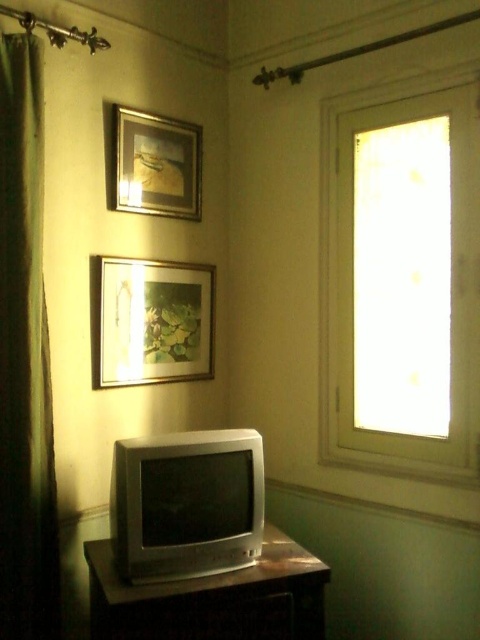
Which is below, transparent glass window at upper right or metallic silver dresser at lower center?

Positioned lower is metallic silver dresser at lower center.

Does transparent glass window at upper right appear on the left side of metallic silver dresser at lower center?

No, transparent glass window at upper right is not to the left of metallic silver dresser at lower center.

Which is in front, point (457, 476) or point (324, 602)?

Point (324, 602) is more forward.

This screenshot has width=480, height=640. In order to click on transparent glass window at upper right in this screenshot , I will do `click(352, 276)`.

Based on the photo, who is shorter, transparent glass window at upper right or green fabric curtain at left?

Standing shorter between the two is transparent glass window at upper right.

Between transparent glass window at upper right and green fabric curtain at left, which one appears on the left side from the viewer's perspective?

green fabric curtain at left

Which is behind, point (470, 96) or point (35, 147)?

Point (470, 96)

Identify the location of transparent glass window at upper right. The width and height of the screenshot is (480, 640). (352, 276).

Looking at this image, does metallic silver dresser at lower center appear on the right side of matte wooden picture frame at center?

Correct, you'll find metallic silver dresser at lower center to the right of matte wooden picture frame at center.

Does metallic silver dresser at lower center have a greater width compared to matte wooden picture frame at center?

Indeed, metallic silver dresser at lower center has a greater width compared to matte wooden picture frame at center.

Does point (319, 621) come in front of point (200, 276)?

Yes, it is in front of point (200, 276).

Locate an element on the screen. This screenshot has width=480, height=640. metallic silver dresser at lower center is located at coordinates (213, 598).